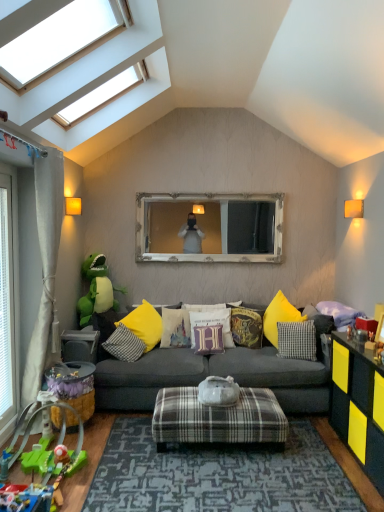
Question: In which direction should I rotate to look at white cotton pillow at center, acting as the 2th pillow starting from the left?

Choices:
 (A) left
 (B) right

Answer: (A)

Question: In which direction should I rotate to look at velvet harry potter-themed pillow at center, the 5th pillow from the left?

Choices:
 (A) left
 (B) right

Answer: (B)

Question: From the image's perspective, is velvet harry potter-themed pillow at center, placed as the second pillow when sorted from right to left, on top of purple velvet pillow at center, the 3th pillow from the left?

Choices:
 (A) no
 (B) yes

Answer: (B)

Question: Can you confirm if velvet harry potter-themed pillow at center, the 5th pillow from the left, is wider than purple velvet pillow at center, the 3th pillow from the left?

Choices:
 (A) yes
 (B) no

Answer: (B)

Question: Is velvet harry potter-themed pillow at center, the 5th pillow from the left, next to purple velvet pillow at center, the 3th pillow from the left, and touching it?

Choices:
 (A) yes
 (B) no

Answer: (B)

Question: Can you confirm if velvet harry potter-themed pillow at center, the 5th pillow from the left, is positioned to the left of purple velvet pillow at center, the 4th pillow viewed from the right?

Choices:
 (A) no
 (B) yes

Answer: (A)

Question: From a real-world perspective, is velvet harry potter-themed pillow at center, placed as the second pillow when sorted from right to left, on purple velvet pillow at center, the 3th pillow from the left?

Choices:
 (A) yes
 (B) no

Answer: (A)

Question: From the image's perspective, would you say velvet harry potter-themed pillow at center, placed as the second pillow when sorted from right to left, is shown under purple velvet pillow at center, the 3th pillow from the left?

Choices:
 (A) no
 (B) yes

Answer: (A)

Question: Is green plastic toy at lower left, the third toy positioned from the back, aimed at green plush toy at left, the first toy positioned from the top?

Choices:
 (A) no
 (B) yes

Answer: (A)

Question: Can you confirm if green plastic toy at lower left, which ranks as the 4th toy in top-to-bottom order, is taller than green plush toy at left, the first toy positioned from the top?

Choices:
 (A) no
 (B) yes

Answer: (A)

Question: Is green plastic toy at lower left, the third toy positioned from the back, not inside green plush toy at left, acting as the fourth toy starting from the front?

Choices:
 (A) no
 (B) yes

Answer: (B)

Question: From the image's perspective, is green plastic toy at lower left, placed as the second toy when sorted from front to back, below green plush toy at left, which is the fourth toy in bottom-to-top order?

Choices:
 (A) yes
 (B) no

Answer: (A)

Question: Can you confirm if green plastic toy at lower left, which is the 1th toy in bottom-to-top order, is positioned to the left of green plush toy at left, which is the fourth toy in bottom-to-top order?

Choices:
 (A) yes
 (B) no

Answer: (A)

Question: Is green plastic toy at lower left, which ranks as the 4th toy in top-to-bottom order, next to green plush toy at left, which is the fourth toy in bottom-to-top order?

Choices:
 (A) no
 (B) yes

Answer: (A)

Question: Is matte gray table at lower left taller than white cotton pillow at center, acting as the 2th pillow starting from the left?

Choices:
 (A) yes
 (B) no

Answer: (B)